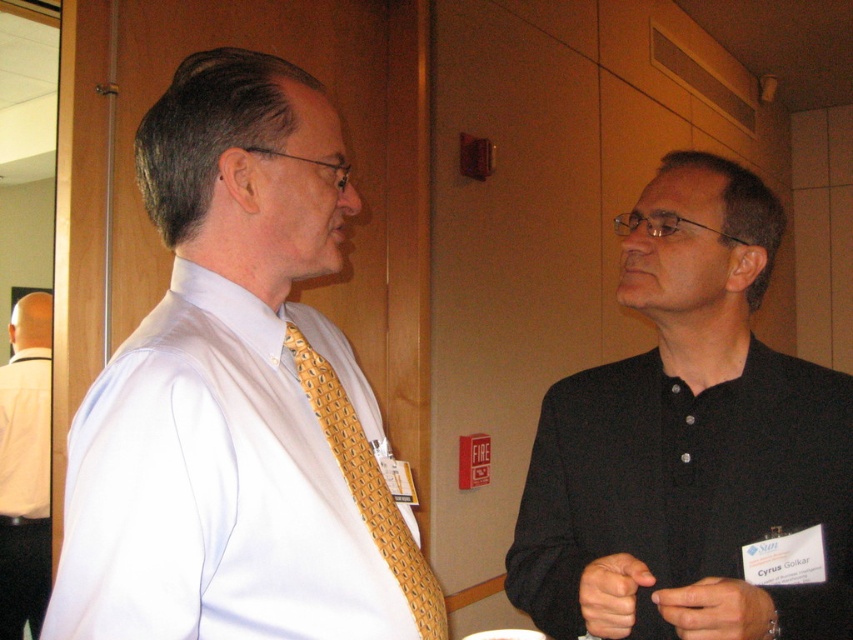
Question: Which object is the closest to the white smooth dress shirt at left?

Choices:
 (A) white shirt at left
 (B) black matte shirt at right

Answer: (B)

Question: Does black matte shirt at right appear on the right side of yellowgeometric patterned fabrictie at left?

Choices:
 (A) yes
 (B) no

Answer: (A)

Question: Estimate the real-world distances between objects in this image. Which object is farther from the white smooth dress shirt at left?

Choices:
 (A) white shirt at left
 (B) yellowgeometric patterned fabrictie at left

Answer: (A)

Question: Which point is farther to the camera?

Choices:
 (A) yellowgeometric patterned fabrictie at left
 (B) white shirt at left
 (C) white smooth dress shirt at left

Answer: (B)

Question: Is white shirt at left bigger than yellowgeometric patterned fabrictie at left?

Choices:
 (A) yes
 (B) no

Answer: (A)

Question: Does white shirt at left appear under yellowgeometric patterned fabrictie at left?

Choices:
 (A) yes
 (B) no

Answer: (A)